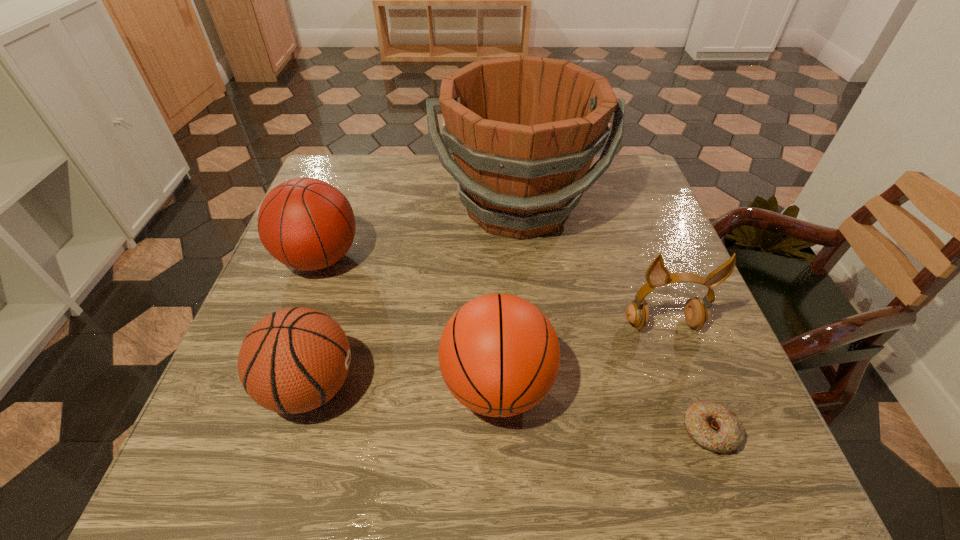
At what (x,y) coordinates should I click in order to perform the action: click on vacant area at the right edge. Please return your answer as a coordinate pair (x, y). This screenshot has width=960, height=540. Looking at the image, I should click on (638, 269).

Image resolution: width=960 pixels, height=540 pixels. I want to click on free region at the far left corner of the desktop, so click(324, 181).

Locate an element on the screen. unoccupied position between the earphone and the rightmost basketball is located at coordinates (580, 355).

In order to click on free spot between the shortest object and the tallest object in this screenshot , I will do `click(613, 319)`.

Locate an element on the screen. Image resolution: width=960 pixels, height=540 pixels. free space that is in between the tallest object and the shortest object is located at coordinates tap(613, 319).

I want to click on free point between the doughnut and the earphone, so click(686, 377).

Identify which object is the fourth closest to the farthest basketball. Please provide its 2D coordinates. Your answer should be formatted as a tuple, i.e. [(x, y)], where the tuple contains the x and y coordinates of a point satisfying the conditions above.

[(696, 314)]

The image size is (960, 540). Identify the location of object that stands as the fourth closest to the tallest object. (294, 360).

Select which basketball appears as the second closest to the bucket. Please provide its 2D coordinates. Your answer should be formatted as a tuple, i.e. [(x, y)], where the tuple contains the x and y coordinates of a point satisfying the conditions above.

[(499, 355)]

Locate which basketball is the third closest to the bucket. Please provide its 2D coordinates. Your answer should be formatted as a tuple, i.e. [(x, y)], where the tuple contains the x and y coordinates of a point satisfying the conditions above.

[(294, 360)]